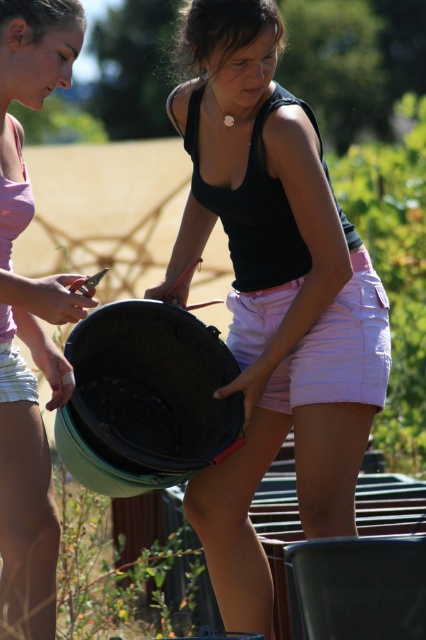
Question: Which point appears farthest from the camera in this image?

Choices:
 (A) (307, 273)
 (B) (42, 552)

Answer: (A)

Question: Is matte black bucket at center smaller than matte black bucket at lower left?

Choices:
 (A) yes
 (B) no

Answer: (B)

Question: From the image, what is the correct spatial relationship of matte black bucket at center in relation to matte black bucket at lower left?

Choices:
 (A) right
 (B) left

Answer: (A)

Question: Among these objects, which one is nearest to the camera?

Choices:
 (A) matte black bucket at center
 (B) matte black bucket at lower left

Answer: (A)

Question: Which of the following is the closest to the observer?

Choices:
 (A) matte black bucket at center
 (B) matte black bucket at lower left

Answer: (A)

Question: Does matte black bucket at center appear over matte black bucket at lower left?

Choices:
 (A) no
 (B) yes

Answer: (B)